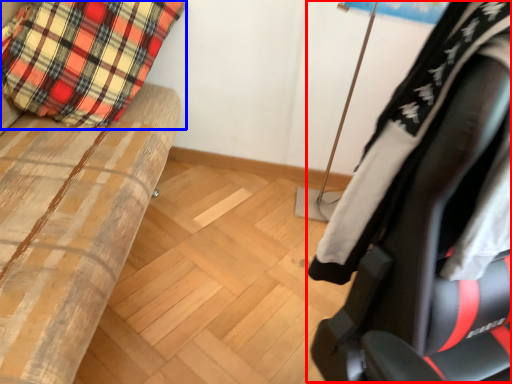
Question: Which point is further to the camera, chair (highlighted by a red box) or pillow (highlighted by a blue box)?

Choices:
 (A) chair
 (B) pillow

Answer: (B)